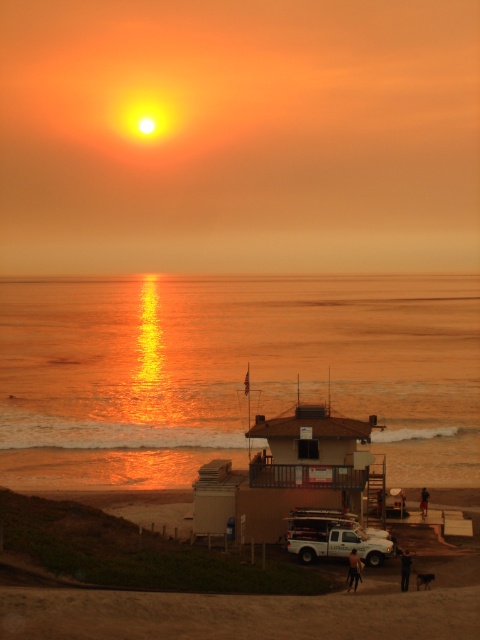
You are standing on the sandy brown beach at lower center and want to walk to the ocean. Which direction should you go to reach the golden reflective water at center?

Since the golden reflective water at center is further to the viewer than the sandy brown beach at lower center, you should walk towards the direction where the water is closer, which is towards the golden reflective water at center.